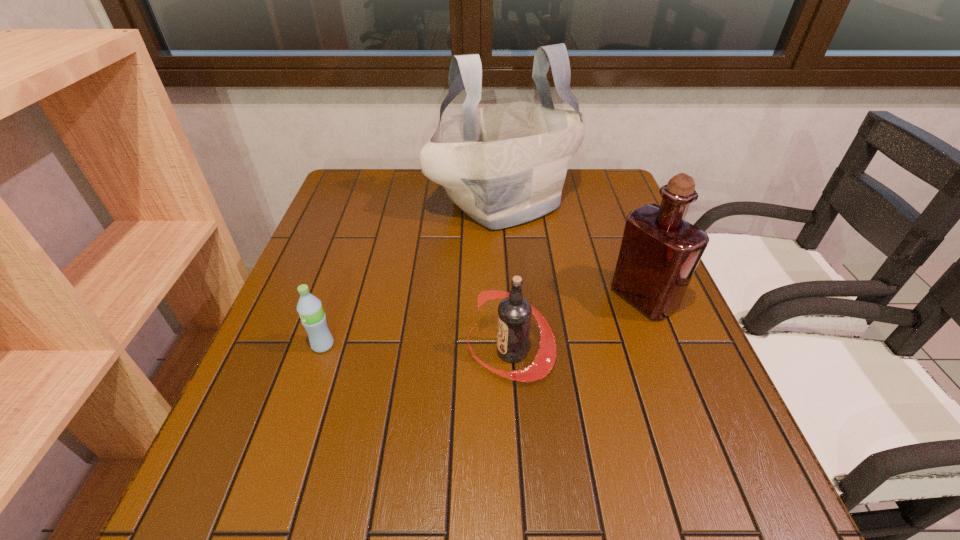
I want to click on vacant space at the right edge of the desktop, so click(619, 210).

In the image, there is a desktop. Where is `vacant region at the far left corner`? vacant region at the far left corner is located at coordinates (391, 180).

Identify the location of vacant space at the far right corner of the desktop. The image size is (960, 540). (587, 177).

In order to click on vacant area at the near right corner of the desktop in this screenshot , I will do `click(684, 499)`.

I want to click on free area in between the root beer and the shortest object, so click(x=417, y=348).

Identify the location of vacant space that's between the shopping bag and the shortest object. The width and height of the screenshot is (960, 540). (413, 274).

The height and width of the screenshot is (540, 960). Find the location of `blank region between the shortest object and the third tallest object`. blank region between the shortest object and the third tallest object is located at coordinates (417, 348).

The height and width of the screenshot is (540, 960). Identify the location of free point between the water bottle and the third tallest object. (x=417, y=348).

Locate an element on the screen. This screenshot has width=960, height=540. free space between the liquor and the water bottle is located at coordinates (483, 321).

You are a GUI agent. You are given a task and a screenshot of the screen. Output one action in this format:
    pyautogui.click(x=<x>, y=<y>)
    Task: Click on the vacant region between the liquor and the root beer
    The height and width of the screenshot is (540, 960).
    Given the screenshot: What is the action you would take?
    pyautogui.click(x=577, y=325)